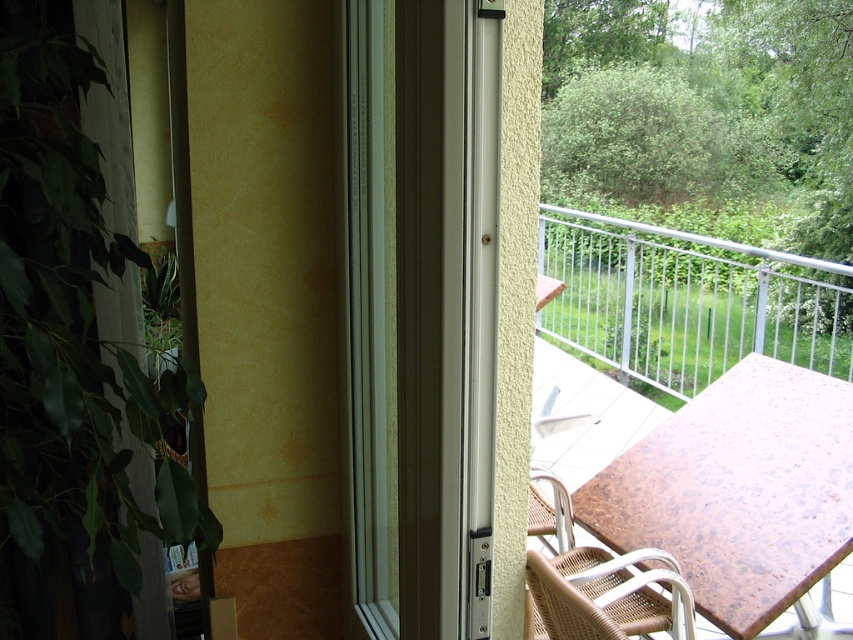
You are standing inside the room and want to place a 3.5 feet long ladder against the wall near the sliding glass door. Can the ladder fit in the space between the viewer and the point at coordinates point (485, 444)?

The distance between the viewer and the point (485, 444) is 3.46 feet, which is slightly shorter than the 3.5 feet ladder. Therefore, the ladder may not fit comfortably in that space.

You are trying to decide which screen door to install between the white plastic screen door at center and the white metallic screen door at center. Based on their sizes, which one would allow more airflow through the sliding glass door?

The white plastic screen door at center has a larger size compared to the white metallic screen door at center, so it would allow more airflow through the sliding glass door.

You are standing at the point marked as point (430, 147) and want to walk to the sliding glass door. Can you reach it without crossing the 38.13 inches distance?

Since the distance between you and the sliding glass door is 38.13 inches, you can easily reach it without crossing that distance.